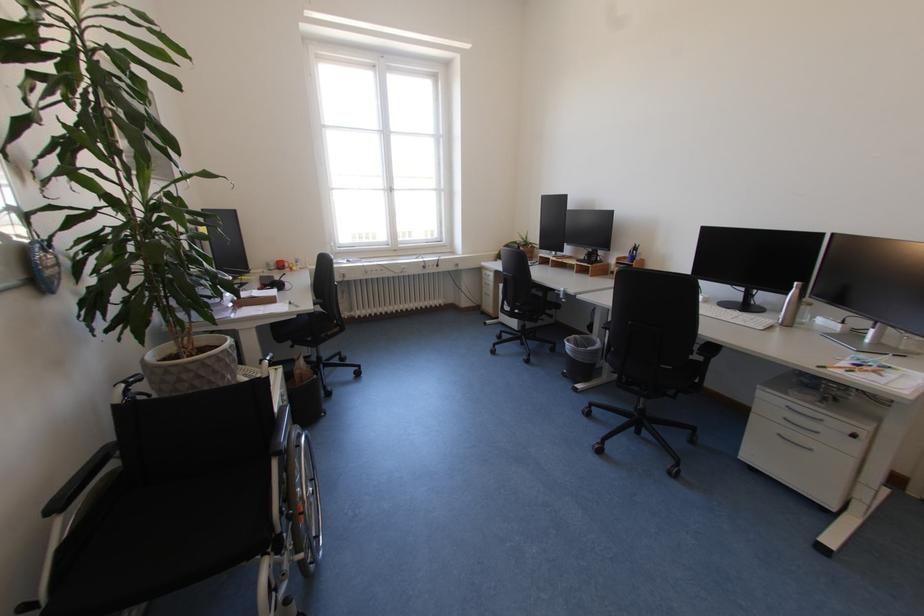
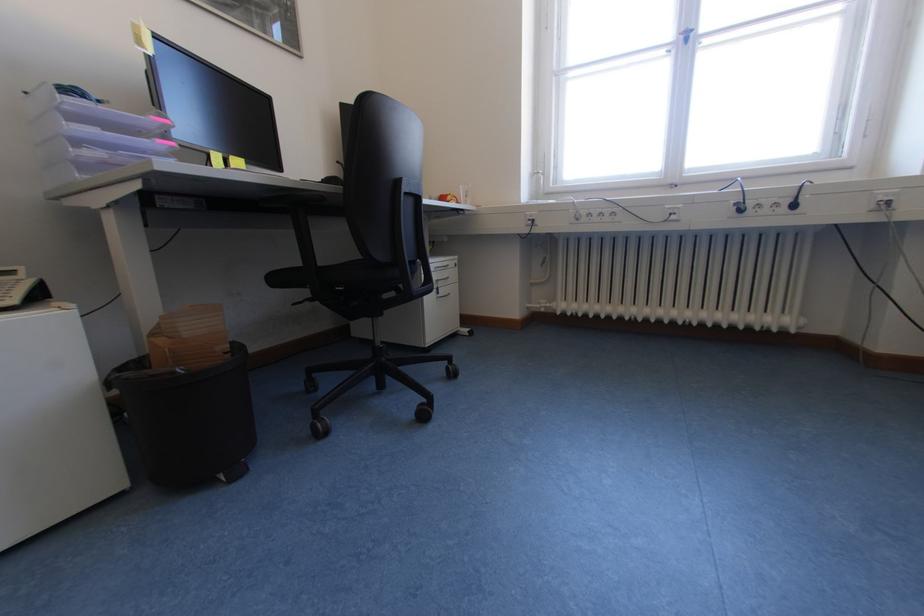
In the second image, find the point that corresponds to point (354, 318) in the first image.

(551, 310)